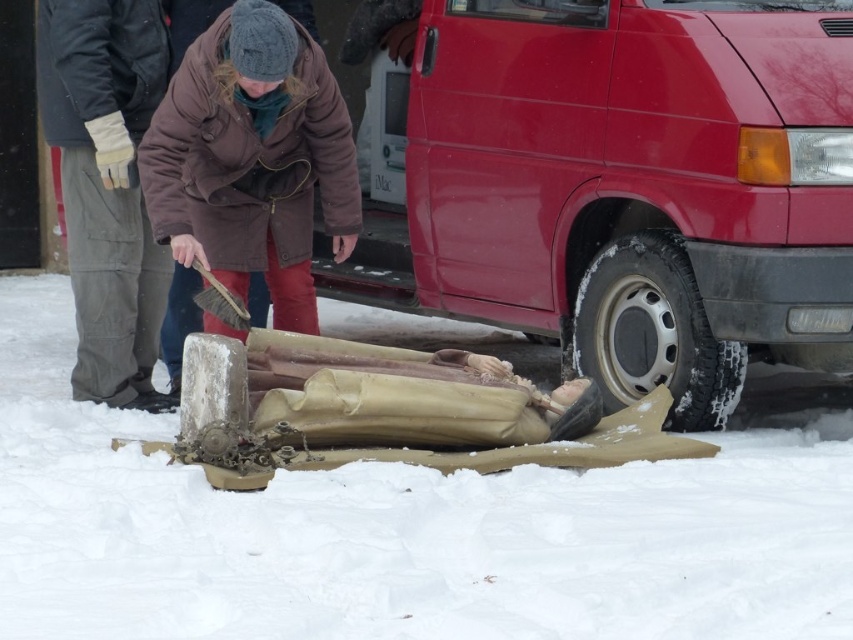
Is gray woolen hat at upper left wider than brown wooden brush at lower center?

Correct, the width of gray woolen hat at upper left exceeds that of brown wooden brush at lower center.

Which is in front, point (138, 355) or point (223, 320)?

Point (223, 320)

Does point (70, 99) come farther from viewer compared to point (218, 292)?

Yes, it is behind point (218, 292).

Where is `gray woolen hat at upper left`? Image resolution: width=853 pixels, height=640 pixels. gray woolen hat at upper left is located at coordinates (106, 186).

I want to click on white matte snow at center, so click(x=412, y=525).

Can you confirm if white matte snow at center is thinner than black rubber tire at lower right?

In fact, white matte snow at center might be wider than black rubber tire at lower right.

Identify the location of white matte snow at center. (412, 525).

Does red matte van at center have a lesser width compared to brown wooden brush at lower center?

No.

Does point (840, 140) lie in front of point (221, 291)?

Yes, it is in front of point (221, 291).

Is point (672, 81) in front of point (196, 262)?

No.

Identify the location of red matte van at center. (614, 182).